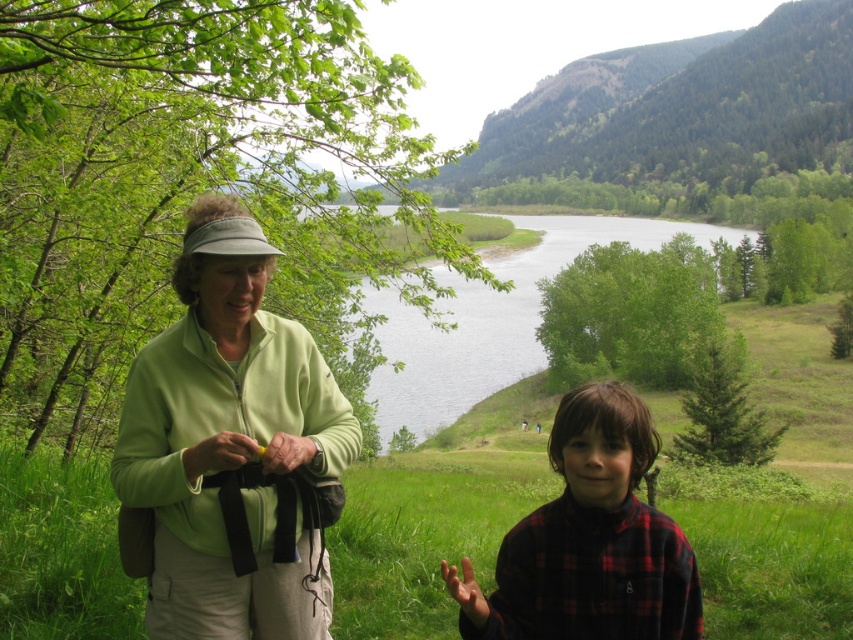
You are planning to take a photo of the green matte jacket at upper left and the green grassy lake at center in the scene. Which object should you focus on first if you want to capture both in a single frame without moving the camera?

The green matte jacket at upper left is smaller than the green grassy lake at center, so you should focus on the green grassy lake at center first to ensure it is in clear view before adjusting for the smaller jacket.

In the scene shown: You are planning to take a photo of the plaid flannel shirt at lower right and the green grassy lake at center. Which object should you focus on first if you want to capture both in the same frame without moving the camera?

The plaid flannel shirt at lower right is below the green grassy lake at center, so you should focus on the plaid flannel shirt at lower right first to ensure it is in the foreground and properly in focus before the background.